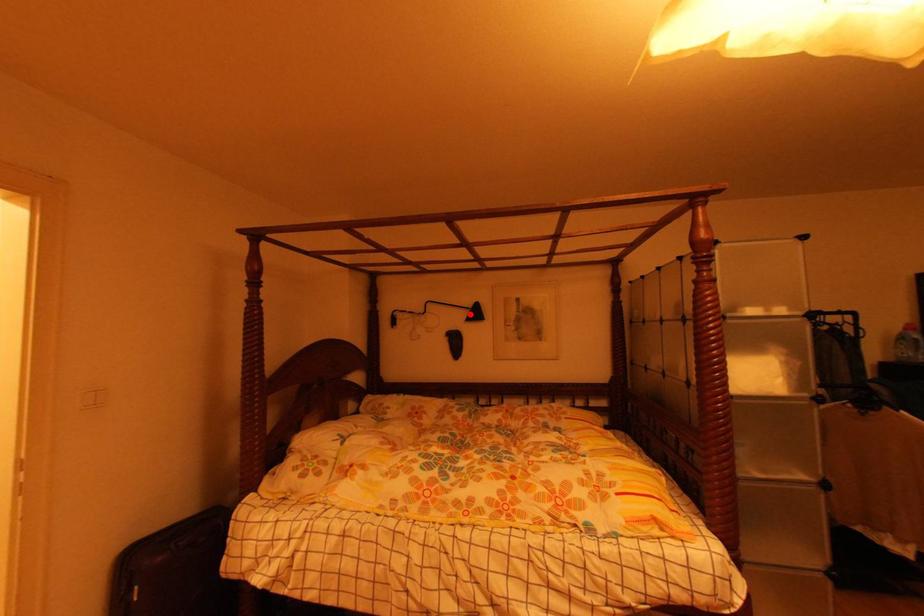
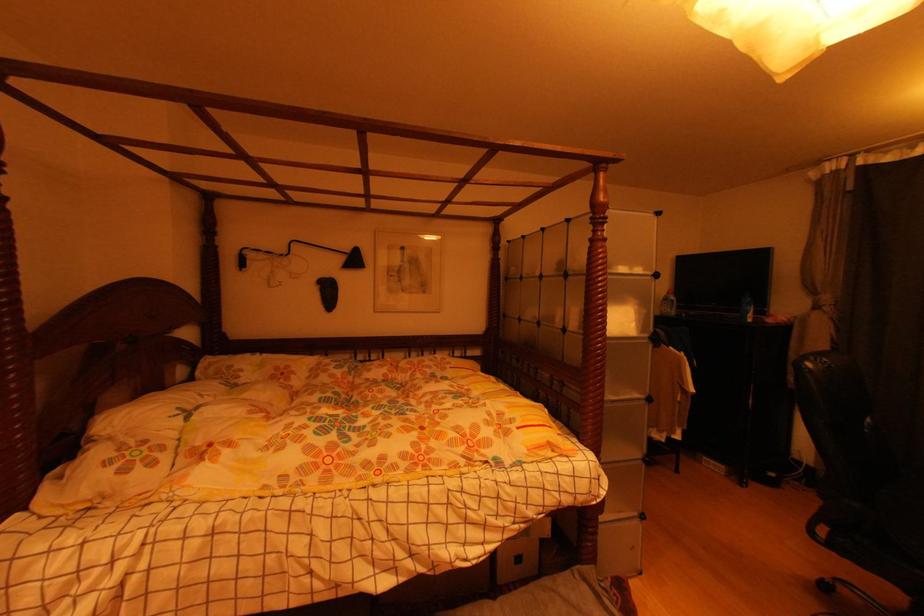
Find the pixel in the second image that matches the highlighted location in the first image.

(346, 261)